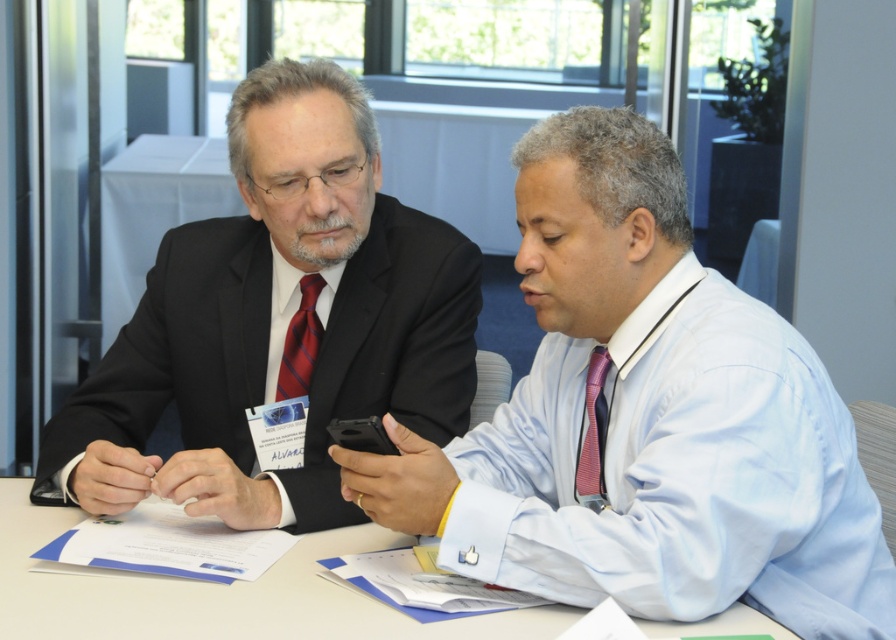
Is point (257, 246) in front of point (514, 614)?

No, it is behind (514, 614).

Does matte black suit at center have a lesser height compared to white paper at center?

Incorrect, matte black suit at center's height does not fall short of white paper at center's.

Describe the element at coordinates (278, 321) in the screenshot. I see `matte black suit at center` at that location.

Find the location of a particular element. The width and height of the screenshot is (896, 640). matte black suit at center is located at coordinates (278, 321).

Is point (360, 632) positioned after point (293, 387)?

No, it is not.

Does white paper at center appear on the right side of matte red tie at center?

Indeed, white paper at center is positioned on the right side of matte red tie at center.

Image resolution: width=896 pixels, height=640 pixels. In order to click on white paper at center in this screenshot , I will do coord(214,593).

Does light blue shirt at center have a greater width compared to white paper at center?

In fact, light blue shirt at center might be narrower than white paper at center.

Can you confirm if light blue shirt at center is positioned above white paper at center?

Indeed, light blue shirt at center is positioned over white paper at center.

Between point (550, 499) and point (648, 625), which one is positioned behind?

The point (550, 499) is behind.

Find the location of a particular element. This screenshot has width=896, height=640. light blue shirt at center is located at coordinates (x=645, y=419).